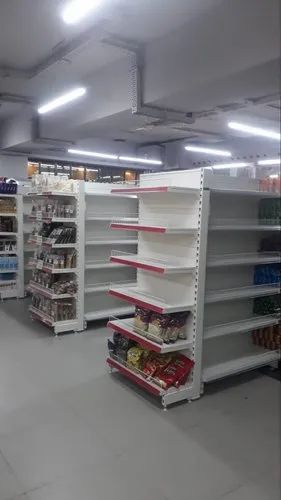
This screenshot has height=500, width=281. In order to click on stocked shelves in this screenshot , I will do `click(5, 292)`, `click(5, 267)`, `click(5, 245)`, `click(6, 224)`, `click(4, 208)`, `click(5, 186)`.